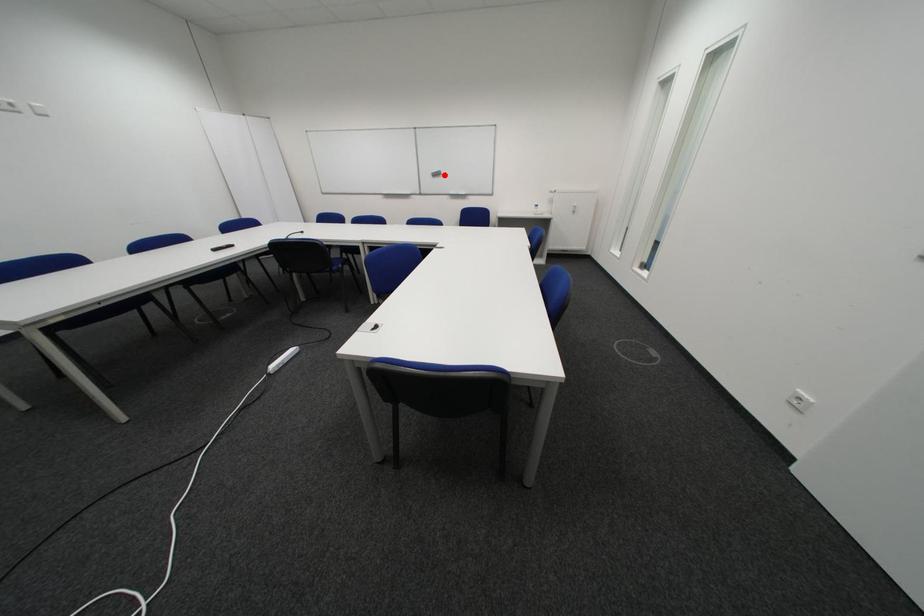
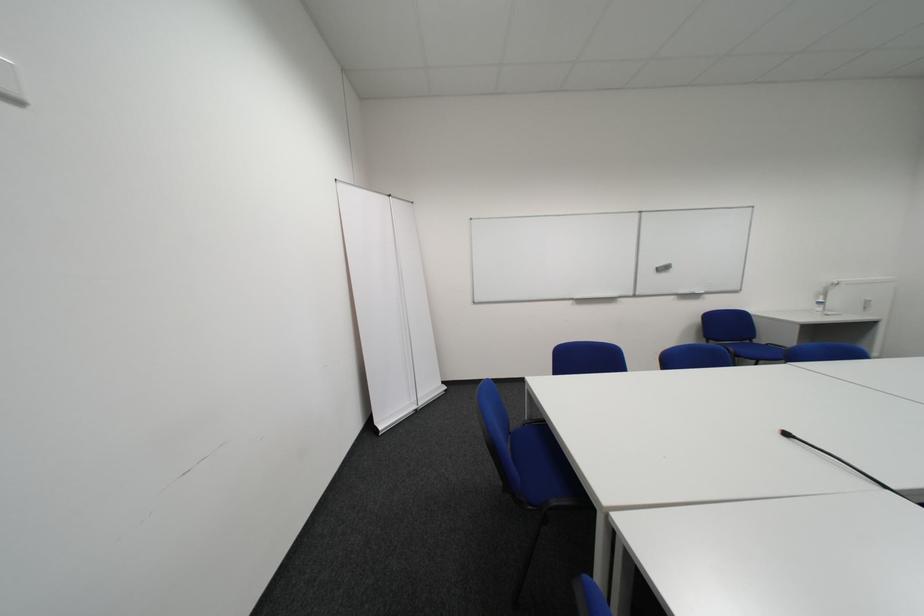
Find the pixel in the second image that matches the highlighted location in the first image.

(669, 270)